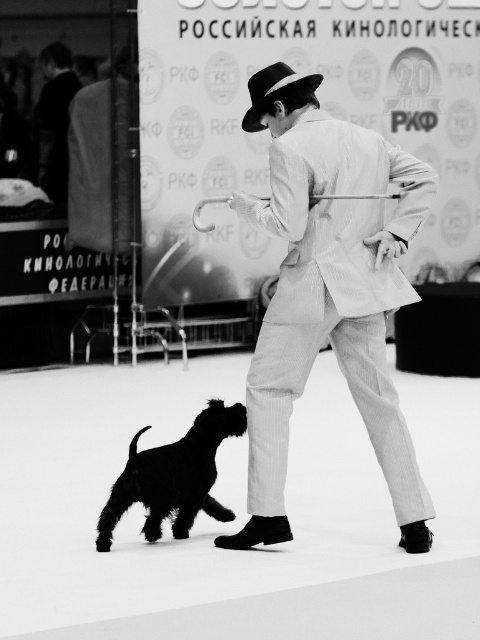
Question: Which of the following is the farthest from the observer?

Choices:
 (A) black felt fedora at center
 (B) black fur dog at lower left
 (C) white pinstripe suit at center

Answer: (B)

Question: Estimate the real-world distances between objects in this image. Which object is farther from the black felt fedora at center?

Choices:
 (A) black fur dog at lower left
 (B) white pinstripe suit at center

Answer: (A)

Question: Is black fur dog at lower left thinner than black felt fedora at center?

Choices:
 (A) yes
 (B) no

Answer: (B)

Question: Does black fur dog at lower left lie behind black felt fedora at center?

Choices:
 (A) no
 (B) yes

Answer: (B)

Question: Which object is the closest to the white pinstripe suit at center?

Choices:
 (A) black felt fedora at center
 (B) black fur dog at lower left

Answer: (B)

Question: Is white pinstripe suit at center above black felt fedora at center?

Choices:
 (A) yes
 (B) no

Answer: (B)